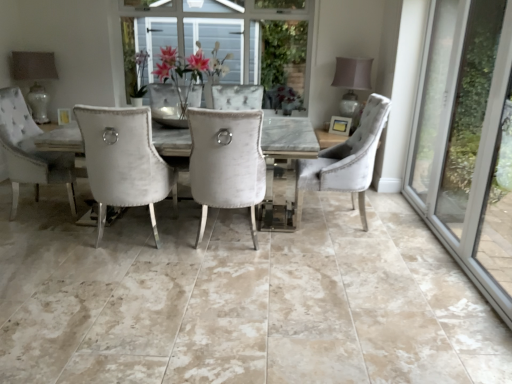
Find the location of a particular element. The height and width of the screenshot is (384, 512). vacant space underneath transparent glass door at right (from a real-world perspective) is located at coordinates (437, 240).